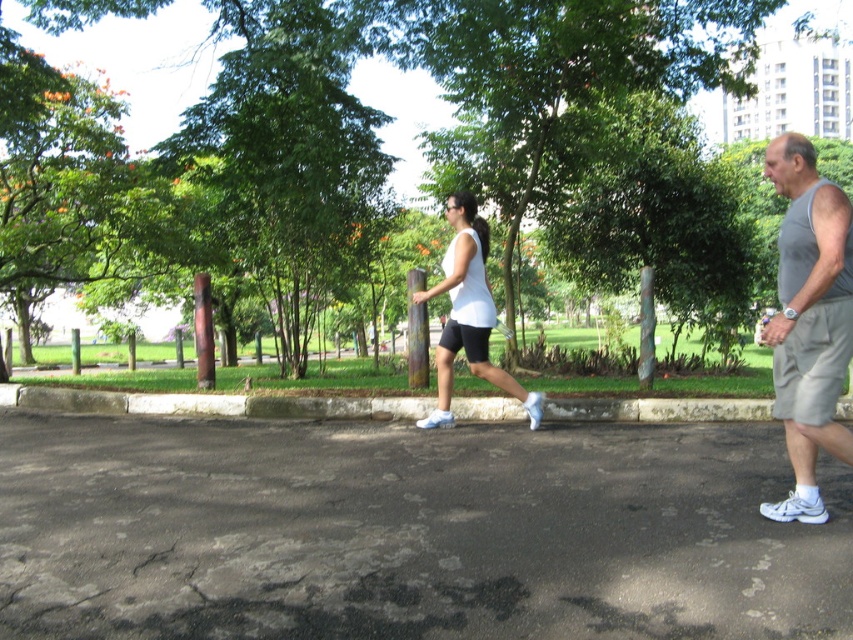
Is green leafy tree at center below white matte shorts at center?

Actually, green leafy tree at center is above white matte shorts at center.

Is point (422, 76) closer to viewer compared to point (469, 202)?

That is False.

At what (x,y) coordinates should I click in order to perform the action: click on green leafy tree at center. Please return your answer as a coordinate pair (x, y). This screenshot has width=853, height=640. Looking at the image, I should click on (144, 64).

Can you confirm if gray fabric tank top at right is thinner than green leafy tree at center?

Yes, gray fabric tank top at right is thinner than green leafy tree at center.

Which is more to the left, gray fabric tank top at right or green leafy tree at center?

From the viewer's perspective, gray fabric tank top at right appears more on the left side.

Is point (840, 256) closer to viewer compared to point (717, 115)?

Yes, it is.

The height and width of the screenshot is (640, 853). I want to click on gray fabric tank top at right, so click(x=809, y=321).

Is gray fabric tank top at right shorter than white matte shorts at center?

In fact, gray fabric tank top at right may be taller than white matte shorts at center.

Describe the element at coordinates (809, 321) in the screenshot. I see `gray fabric tank top at right` at that location.

Which is behind, point (808, 193) or point (463, 316)?

The point (463, 316) is behind.

This screenshot has height=640, width=853. I want to click on gray fabric tank top at right, so click(x=809, y=321).